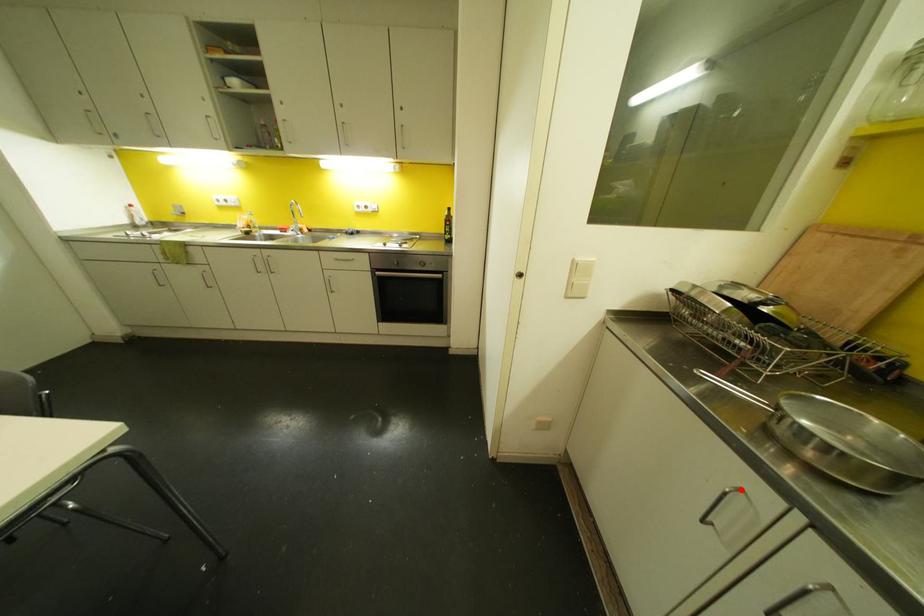
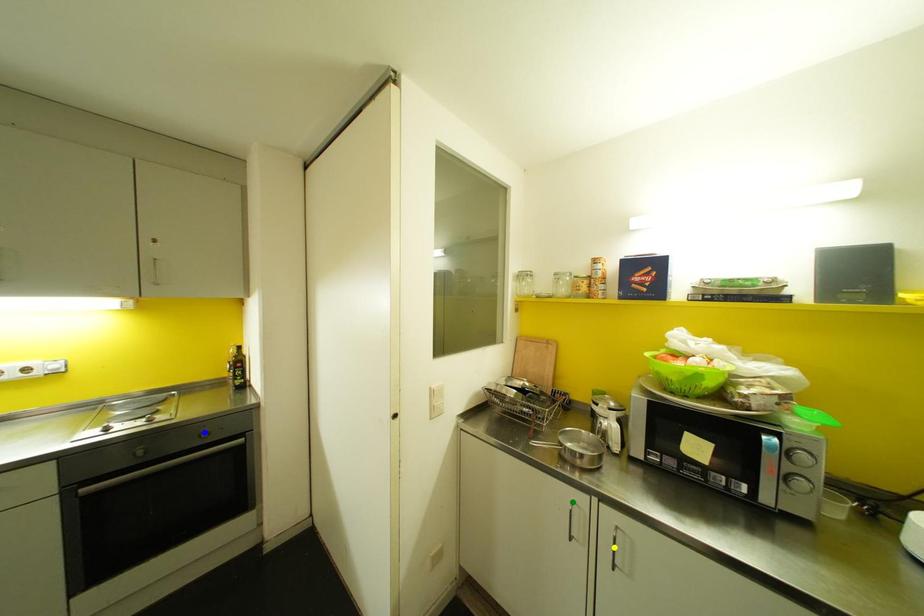
Question: I am providing you with two images of the same scene from different viewpoints. A red point is marked on the first image. You are given multiple points on the second image. Which point in image 2 is actually the same real-world point as the red point in image 1?

Choices:
 (A) yellow point
 (B) blue point
 (C) green point

Answer: (C)